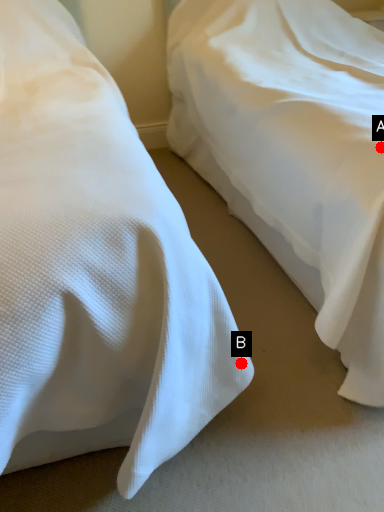
Question: Two points are circled on the image, labeled by A and B beside each circle. Which point is closer to the camera?

Choices:
 (A) A is closer
 (B) B is closer

Answer: (B)